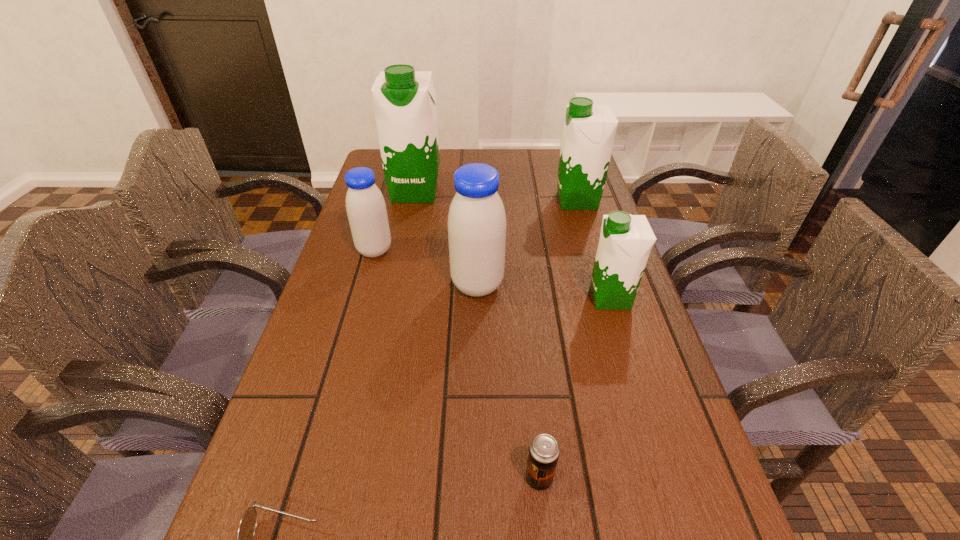
Image resolution: width=960 pixels, height=540 pixels. What are the coordinates of `empty space between the nearest green soya milk and the sixth tallest object` in the screenshot? It's located at (575, 388).

Where is `object that is the fifth closest to the tallest soya milk`? The width and height of the screenshot is (960, 540). object that is the fifth closest to the tallest soya milk is located at coordinates (544, 450).

Find the location of a particular element. object that is the sixth closest to the black beer can is located at coordinates (404, 100).

Locate an element on the screen. Image resolution: width=960 pixels, height=540 pixels. soya milk that is the closest to the biggest green soya milk is located at coordinates (365, 205).

Choose which soya milk is the fourth nearest neighbor to the smallest green soya milk. Please provide its 2D coordinates. Your answer should be formatted as a tuple, i.e. [(x, y)], where the tuple contains the x and y coordinates of a point satisfying the conditions above.

[(404, 100)]

Select which green soya milk is the second closest to the bigger blue soya milk. Please provide its 2D coordinates. Your answer should be formatted as a tuple, i.e. [(x, y)], where the tuple contains the x and y coordinates of a point satisfying the conditions above.

[(404, 100)]

Locate an element on the screen. Image resolution: width=960 pixels, height=540 pixels. the second closest green soya milk to the nearest green soya milk is located at coordinates (404, 100).

This screenshot has height=540, width=960. Identify the location of vacant region that satisfies the following two spatial constraints: 1. on the front-facing side of the fourth object from left to right; 2. on the left side of the tallest soya milk. (396, 285).